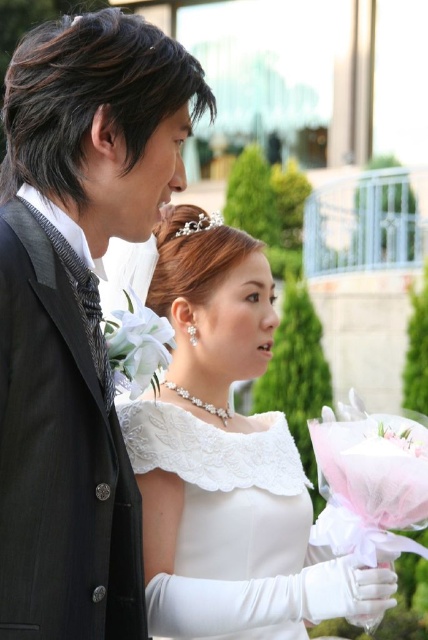
You are a photographer at a wedding. You need to adjust the lighting so that both the white lace dress at center and the white silk flower at center are equally illuminated. Given their current heights, which object should you raise the light source closer to?

The white lace dress at center is taller than the white silk flower at center, so you should raise the light source closer to the white silk flower at center to ensure both receive equal illumination.